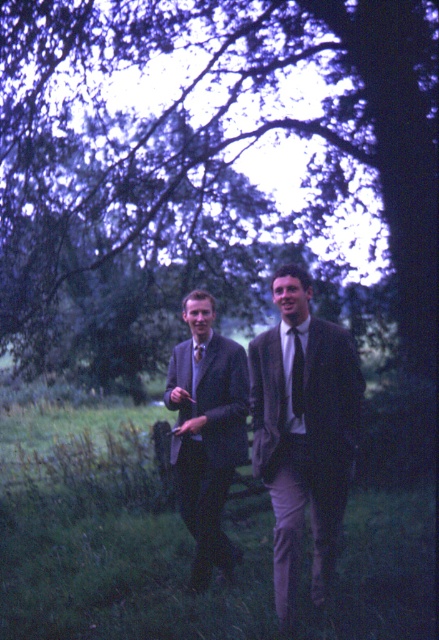
Question: Is green leafy tree at upper center positioned in front of matte brown tie at center?

Choices:
 (A) yes
 (B) no

Answer: (B)

Question: Which point is farther to the camera?

Choices:
 (A) (128, 138)
 (B) (297, 401)
 (C) (187, 342)

Answer: (A)

Question: Considering the relative positions of matte black suit at center and purple satin tie at center in the image provided, where is matte black suit at center located with respect to purple satin tie at center?

Choices:
 (A) above
 (B) below

Answer: (B)

Question: Is matte black suit at center wider than purple satin tie at center?

Choices:
 (A) yes
 (B) no

Answer: (A)

Question: Which of the following is the farthest from the observer?

Choices:
 (A) matte brown suit at center
 (B) matte brown tie at center
 (C) green leafy tree at upper center

Answer: (C)

Question: Which object is farther from the camera taking this photo?

Choices:
 (A) green leafy tree at upper center
 (B) matte brown suit at center

Answer: (A)